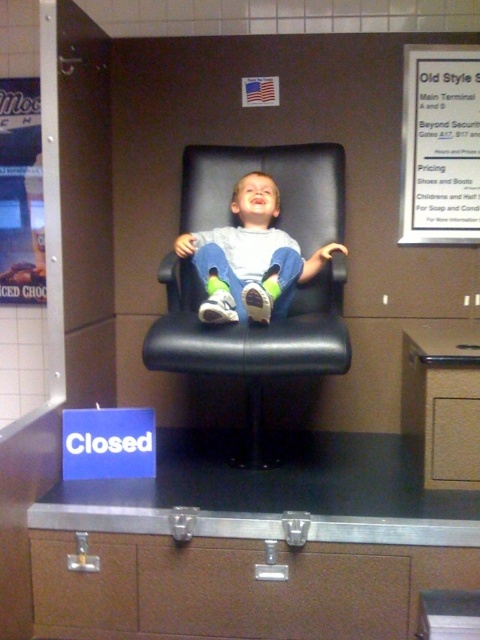
Can you confirm if black leather swivel chair at center is smaller than white paper at upper right?

No, black leather swivel chair at center is not smaller than white paper at upper right.

Which is in front, point (321, 214) or point (444, 92)?

Point (321, 214) is in front.

Which is behind, point (195, 148) or point (412, 90)?

The point (195, 148) is behind.

I want to click on black leather swivel chair at center, so 251,346.

Does black leather swivel chair at center appear on the right side of matte black chair at center?

Result: Incorrect, black leather swivel chair at center is not on the right side of matte black chair at center.

Is point (336, 308) positioned before point (225, 268)?

No, (336, 308) is behind (225, 268).

Locate an element on the screen. This screenshot has height=640, width=480. black leather swivel chair at center is located at coordinates (251, 346).

Does white paper at upper right have a greater height compared to matte black chair at center?

Indeed, white paper at upper right has a greater height compared to matte black chair at center.

Who is taller, white paper at upper right or matte black chair at center?

With more height is white paper at upper right.

The height and width of the screenshot is (640, 480). What are the coordinates of `white paper at upper right` in the screenshot? It's located at (440, 145).